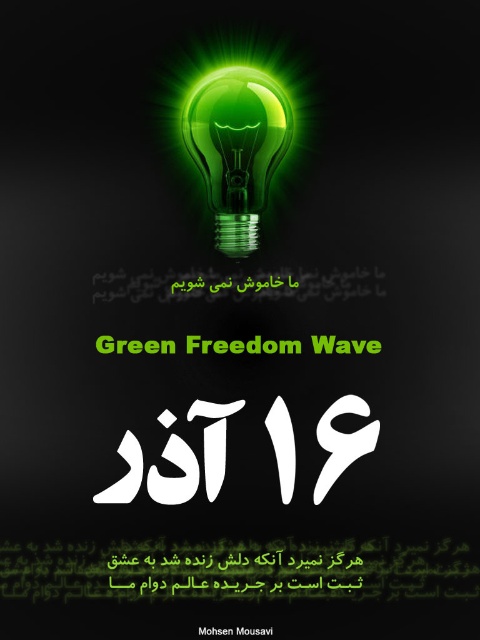
Which is in front, point (169, 579) or point (272, 630)?

Point (272, 630) is in front.

Does point (197, 557) come behind point (269, 632)?

Yes, point (197, 557) is farther from viewer.

Image resolution: width=480 pixels, height=640 pixels. What are the coordinates of `black matte text at lower center` in the screenshot? It's located at (235, 570).

Which of these two, green glass bulb at center or black matte text at lower center, stands shorter?

black matte text at lower center

Does green glass bulb at center have a greater height compared to black matte text at lower center?

Yes.

The height and width of the screenshot is (640, 480). Identify the location of green glass bulb at center. (237, 147).

Between green glass bulb at center and black paper at center, which one appears on the right side from the viewer's perspective?

green glass bulb at center

Between point (249, 209) and point (217, 628), which one is positioned in front?

Positioned in front is point (249, 209).

You are a GUI agent. You are given a task and a screenshot of the screen. Output one action in this format:
    pyautogui.click(x=<x>, y=<y>)
    Task: Click on the green glass bulb at center
    The height and width of the screenshot is (640, 480).
    Given the screenshot: What is the action you would take?
    pyautogui.click(x=237, y=147)